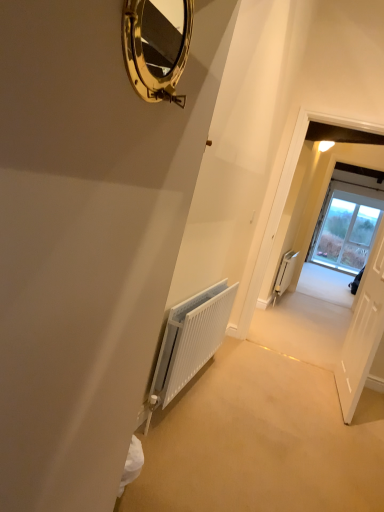
Question: Considering their positions, is gold polished mirror at upper center located in front of or behind white glossy door at center?

Choices:
 (A) front
 (B) behind

Answer: (A)

Question: From the image's perspective, is gold polished mirror at upper center positioned above or below white glossy door at center?

Choices:
 (A) below
 (B) above

Answer: (B)

Question: Estimate the real-world distances between objects in this image. Which object is closer to the gold polished mirror at upper center?

Choices:
 (A) white matte radiator at right, which appears as the 2th radiator when viewed from the front
 (B) white textured radiator at center, placed as the second radiator when sorted from right to left
 (C) white wooden door at right
 (D) white glossy door at center

Answer: (B)

Question: Which object is the farthest from the white wooden door at right?

Choices:
 (A) white matte radiator at right, positioned as the second radiator in left-to-right order
 (B) gold polished mirror at upper center
 (C) white textured radiator at center, which is the first radiator from front to back
 (D) white glossy door at center

Answer: (B)